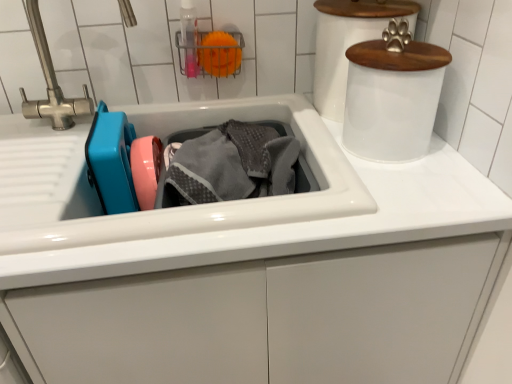
Locate an element on the screen. The width and height of the screenshot is (512, 384). vacant area in front of white frosted plastic canister at upper right, the first appliance from the front is located at coordinates (425, 190).